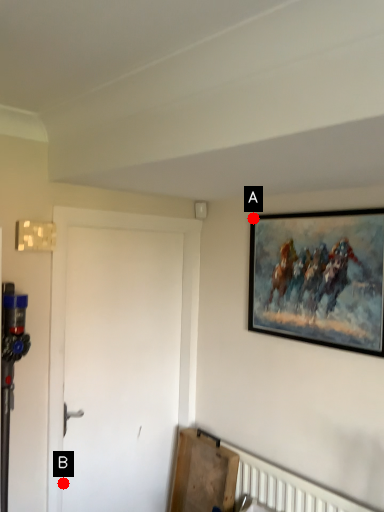
Question: Two points are circled on the image, labeled by A and B beside each circle. Among these points, which one is nearest to the camera?

Choices:
 (A) A is closer
 (B) B is closer

Answer: (B)